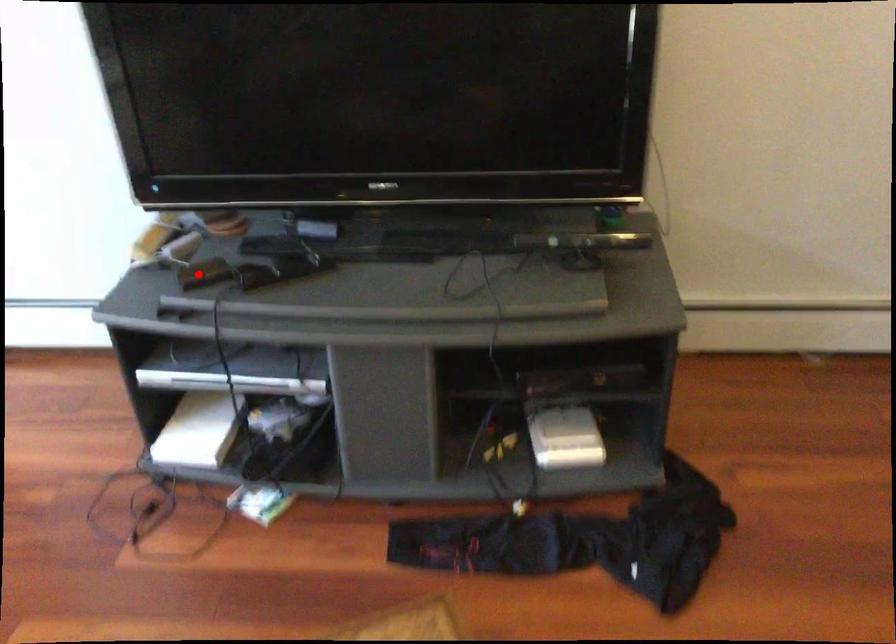
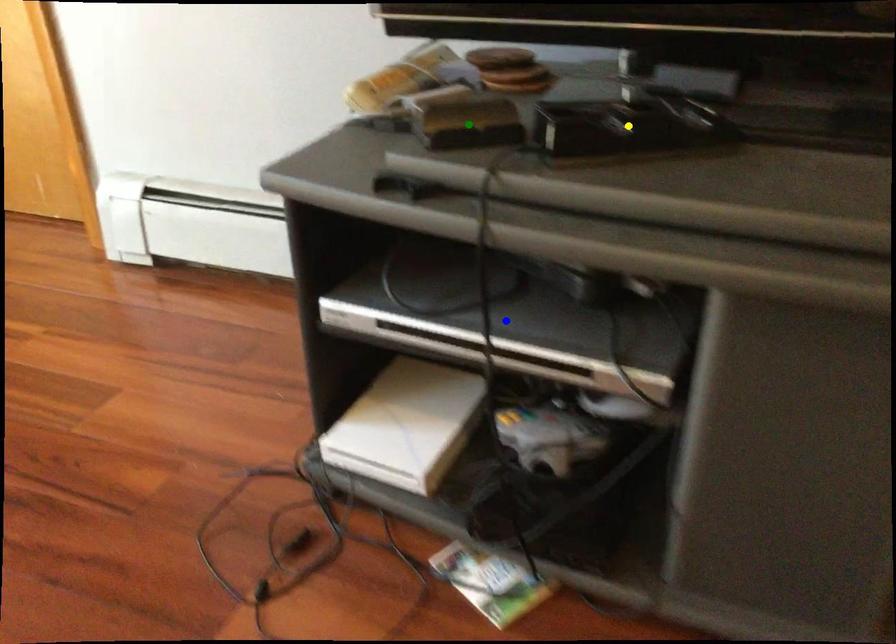
Question: I am providing you with two images of the same scene from different viewpoints. A red point is marked on the first image. You are given multiple points on the second image. Which point in image 2 is actually the same real-world point as the red point in image 1?

Choices:
 (A) green point
 (B) yellow point
 (C) blue point

Answer: (A)